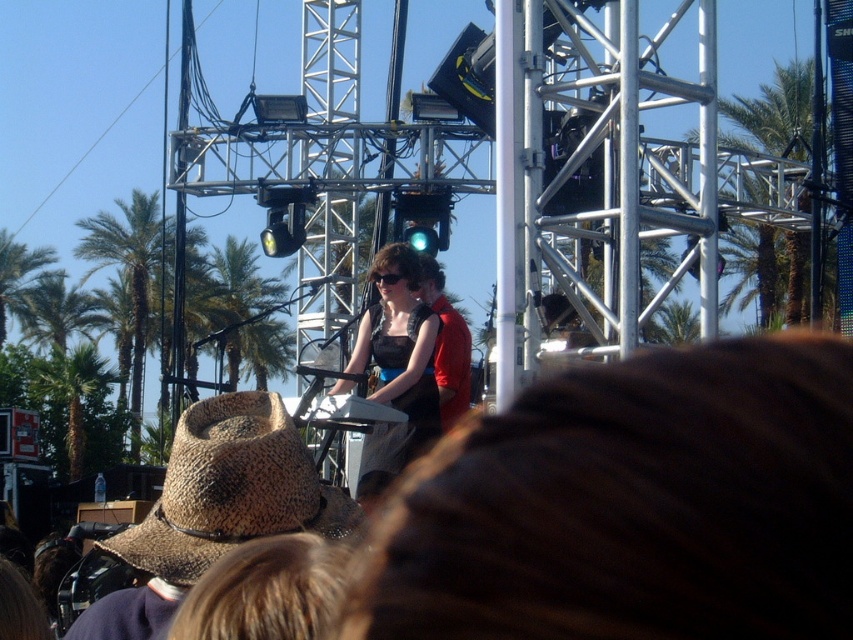
Question: Which point is closer to the camera?

Choices:
 (A) brown woven cowboy hat at lower left
 (B) green leafy palm tree at left

Answer: (A)

Question: Considering the relative positions of brown woven cowboy hat at lower left and matte black dress at center in the image provided, where is brown woven cowboy hat at lower left located with respect to matte black dress at center?

Choices:
 (A) right
 (B) left

Answer: (B)

Question: Is green leafy palm tree at center smaller than green leafy palm tree at left?

Choices:
 (A) yes
 (B) no

Answer: (A)

Question: Which point is farther to the camera?

Choices:
 (A) [x=413, y=394]
 (B) [x=236, y=285]
 (C) [x=242, y=433]
 (D) [x=137, y=189]

Answer: (B)

Question: Does brown woven cowboy hat at lower left appear on the right side of green leafy palm tree at center?

Choices:
 (A) no
 (B) yes

Answer: (B)

Question: Which of the following is the closest to the observer?

Choices:
 (A) brown woven cowboy hat at lower left
 (B) green leafy palm tree at left

Answer: (A)